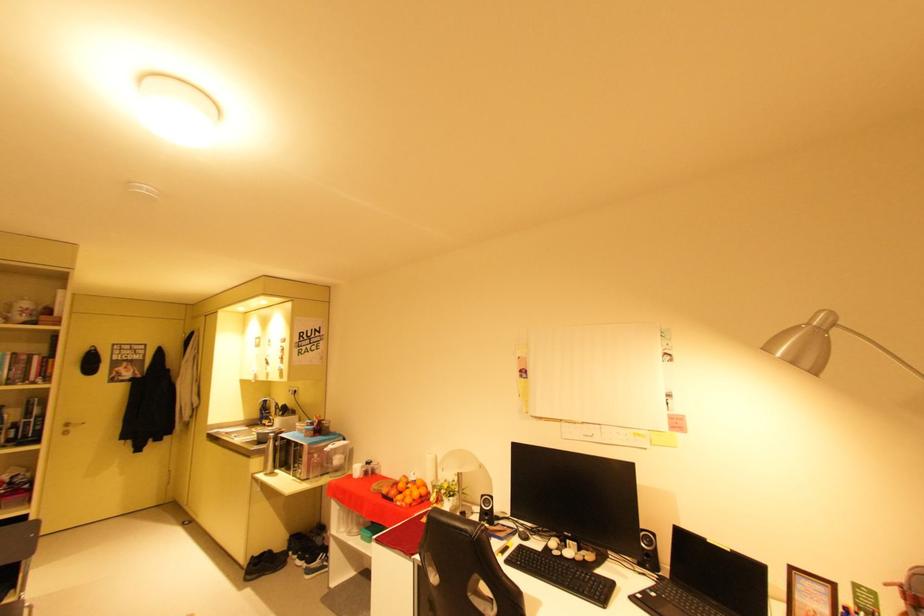
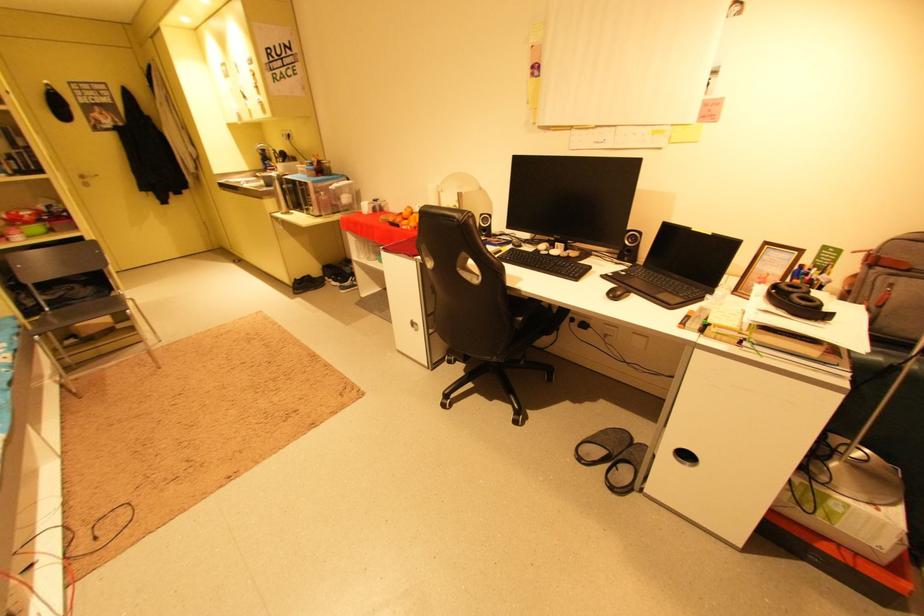
Where in the second image is the point corresponding to pixel 406 504 from the first image?

(410, 228)